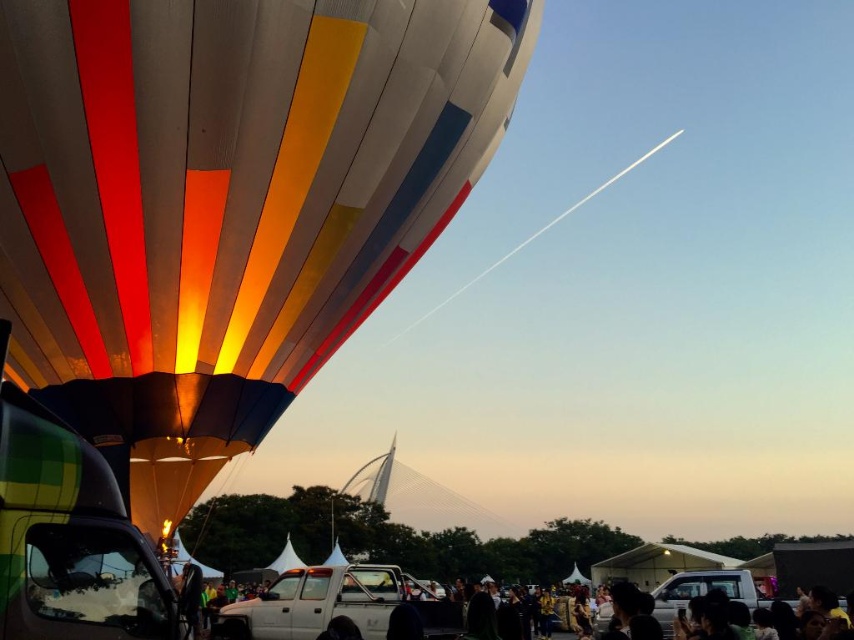
Which is behind, point (361, 289) or point (305, 573)?

Point (305, 573)

Describe the element at coordinates (225, 202) in the screenshot. I see `multicolored fabric hot air balloon at upper left` at that location.

Where is `multicolored fabric hot air balloon at upper left`? The image size is (854, 640). multicolored fabric hot air balloon at upper left is located at coordinates (225, 202).

Locate an element on the screen. This screenshot has height=640, width=854. multicolored fabric hot air balloon at upper left is located at coordinates (225, 202).